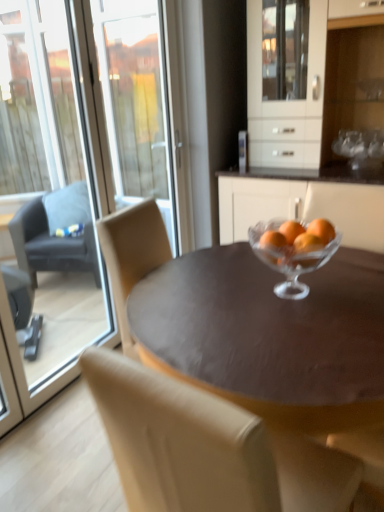
Find the location of a particular element. Image resolution: width=384 pixels, height=512 pixels. blank space to the left of clear glass bowl at center is located at coordinates (231, 298).